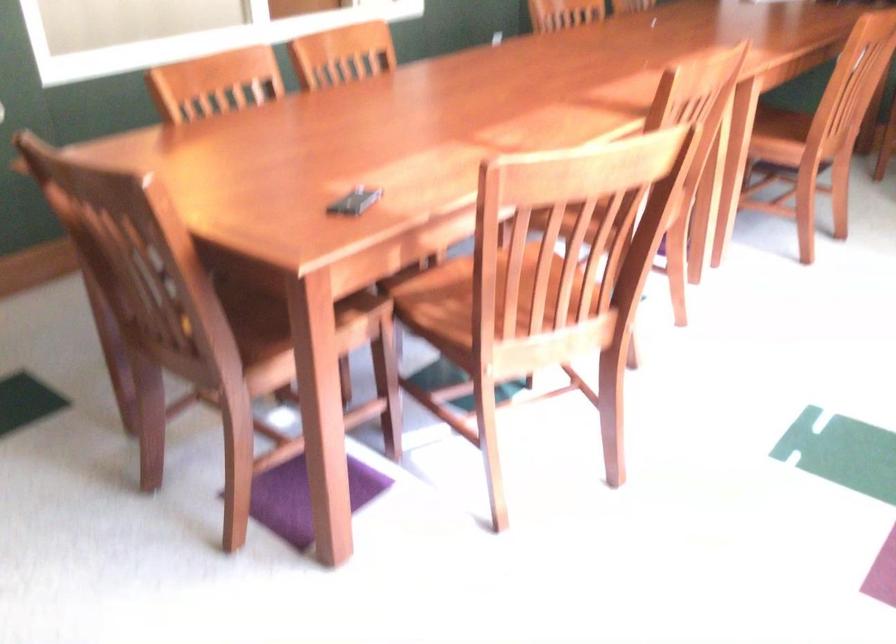
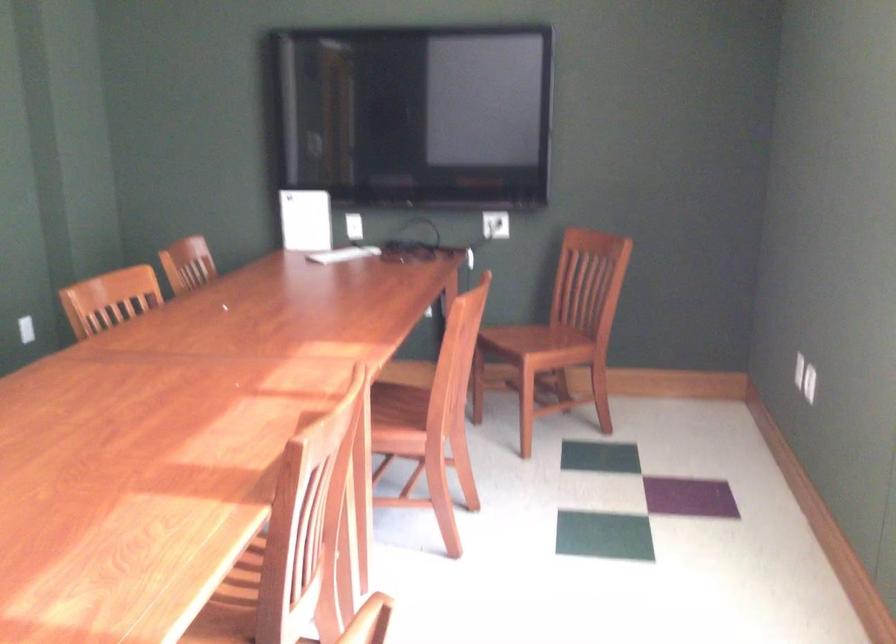
Question: The camera is either moving clockwise (left) or counter-clockwise (right) around the object. The first image is from the beginning of the video and the second image is from the end. Is the camera moving left or right when shooting the video?

Choices:
 (A) Left
 (B) Right

Answer: (A)